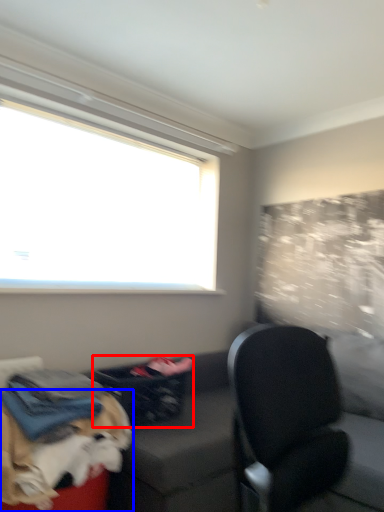
Question: Which object appears closest to the camera in this image, laundry basket (highlighted by a red box) or dog (highlighted by a blue box)?

Choices:
 (A) laundry basket
 (B) dog

Answer: (B)